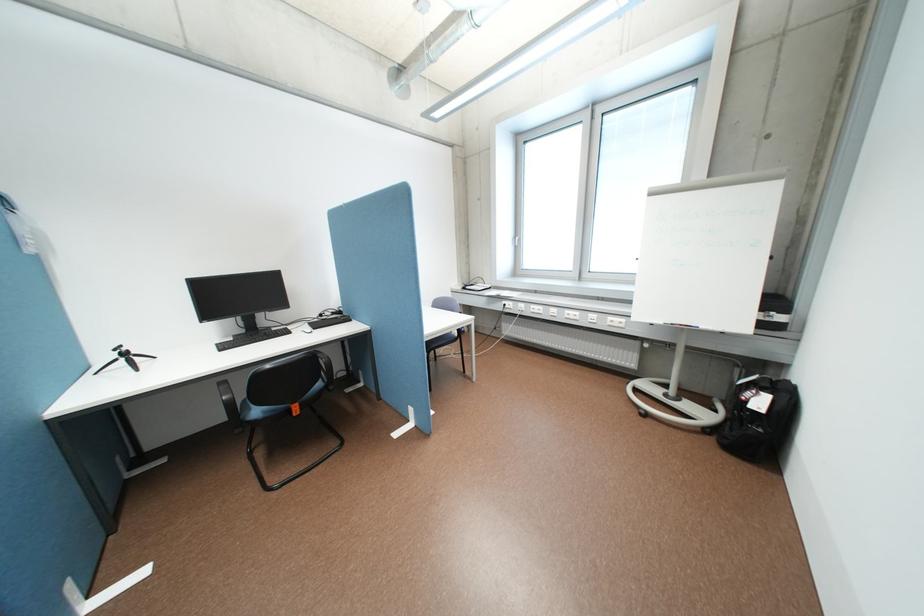
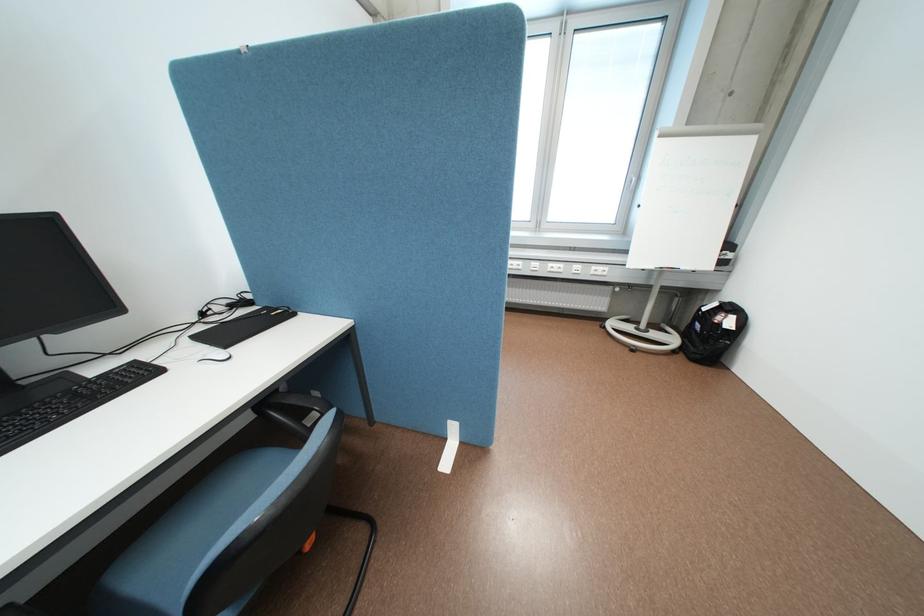
Find the pixel in the second image that matches the point at 723,439 in the first image.

(691, 357)